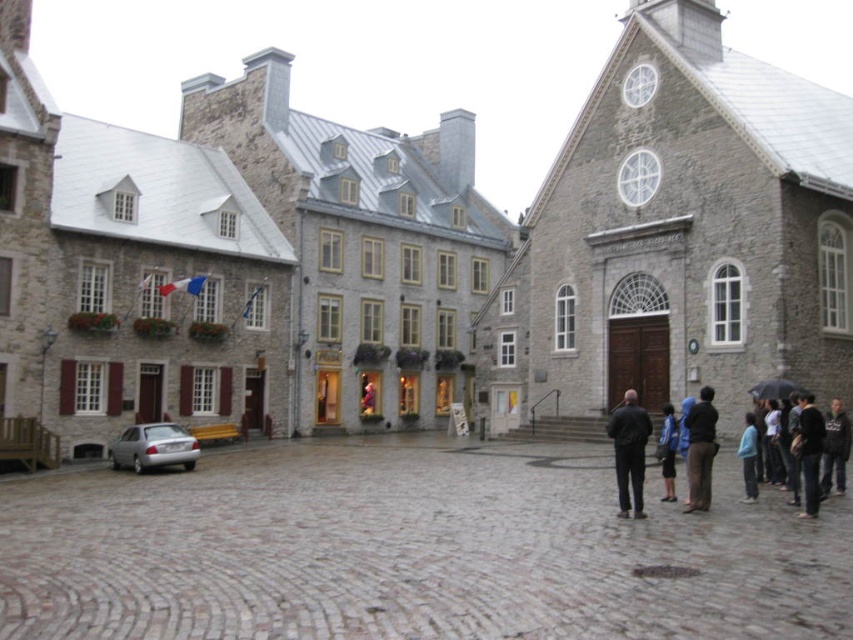
Is gray stone church at center positioned behind black leather jacket at lower right?

That is True.

Between gray stone church at center and black leather jacket at lower right, which one has more height?

gray stone church at center

Between point (592, 387) and point (630, 408), which one is positioned behind?

Point (592, 387)

I want to click on gray stone church at center, so [677, 236].

Is point (785, 445) positioned behind point (844, 442)?

Yes.

This screenshot has width=853, height=640. Describe the element at coordinates (804, 451) in the screenshot. I see `dark gray fabric jacket at lower right` at that location.

Find the location of `dark gray fabric jacket at lower right`. dark gray fabric jacket at lower right is located at coordinates (804, 451).

Between dark gray fabric jacket at lower right and dark gray sweater at lower right, which one has less height?

With less height is dark gray sweater at lower right.

Does dark gray fabric jacket at lower right appear on the right side of dark gray sweater at lower right?

Indeed, dark gray fabric jacket at lower right is positioned on the right side of dark gray sweater at lower right.

What do you see at coordinates (804, 451) in the screenshot? The width and height of the screenshot is (853, 640). I see `dark gray fabric jacket at lower right` at bounding box center [804, 451].

Identify the location of dark gray fabric jacket at lower right. Image resolution: width=853 pixels, height=640 pixels. (804, 451).